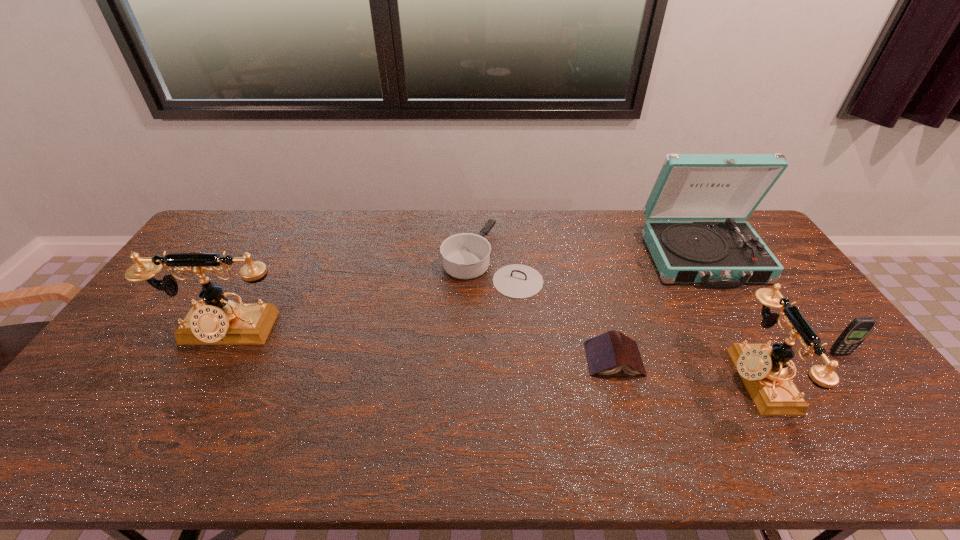
The image size is (960, 540). I want to click on the fourth object from right to left, so click(x=608, y=353).

At what (x,y) coordinates should I click in order to perform the action: click on vacant area situated 0.160m on the dial of the taller telephone. Please return your answer as a coordinate pair (x, y). This screenshot has height=540, width=960. Looking at the image, I should click on (185, 403).

Find the location of a particular element. The height and width of the screenshot is (540, 960). vacant space located on the dial of the fourth shortest object is located at coordinates (611, 379).

In order to click on vacant space situated 0.240m on the dial of the fourth shortest object in this screenshot , I will do `click(641, 379)`.

Find the location of a particular element. This screenshot has width=960, height=540. free space located 0.390m on the dial of the fourth shortest object is located at coordinates (584, 379).

The height and width of the screenshot is (540, 960). In order to click on vacant space positioned on the front of the second shortest object in this screenshot , I will do `click(492, 325)`.

You are a GUI agent. You are given a task and a screenshot of the screen. Output one action in this format:
    pyautogui.click(x=<x>, y=<y>)
    Task: Click on the vacant space located on the face side of the record player
    
    Given the screenshot: What is the action you would take?
    pyautogui.click(x=729, y=301)

The width and height of the screenshot is (960, 540). Find the location of `vacant space situated on the screen of the rightmost object`. vacant space situated on the screen of the rightmost object is located at coordinates (854, 374).

Locate an element on the screen. Image resolution: width=960 pixels, height=540 pixels. vacant space situated 0.180m on the back of the book is located at coordinates (597, 298).

The height and width of the screenshot is (540, 960). I want to click on saucepan that is at the far edge, so click(x=466, y=255).